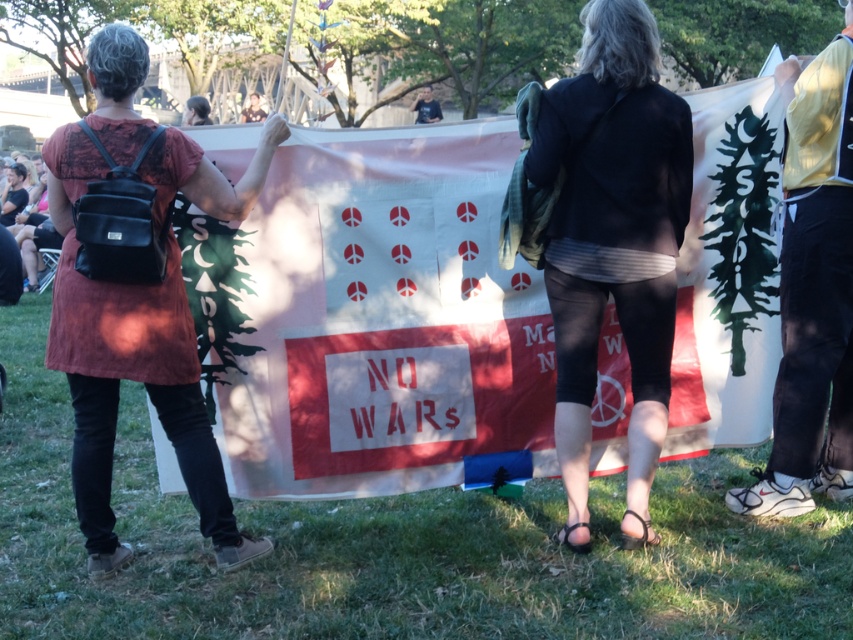
Question: Does black fabric jacket at center appear under matte black backpack at left?

Choices:
 (A) yes
 (B) no

Answer: (B)

Question: Does black fabric jacket at center appear on the left side of matte black backpack at left?

Choices:
 (A) yes
 (B) no

Answer: (B)

Question: Which of the following is the farthest from the observer?

Choices:
 (A) black fabric jacket at center
 (B) matte black backpack at left

Answer: (A)

Question: Which of the following is the closest to the observer?

Choices:
 (A) black fabric jacket at center
 (B) matte black backpack at left

Answer: (B)

Question: From the image, what is the correct spatial relationship of black fabric jacket at center in relation to matte black backpack at left?

Choices:
 (A) right
 (B) left

Answer: (A)